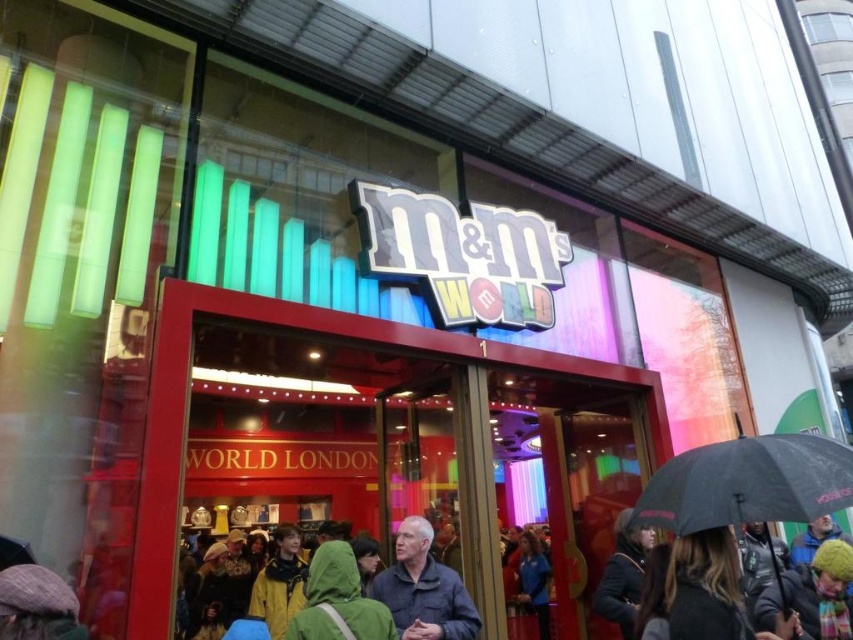
Question: Among these objects, which one is farthest from the camera?

Choices:
 (A) black matte umbrella at lower right
 (B) green hooded jacket at center
 (C) green matte jacket at center
 (D) dark blue jacket at center

Answer: (B)

Question: Is green hooded jacket at center above dark blue jacket at center?

Choices:
 (A) yes
 (B) no

Answer: (A)

Question: Among these points, which one is nearest to the camera?

Choices:
 (A) (766, 444)
 (B) (213, 301)
 (C) (636, 541)
 (D) (305, 621)

Answer: (D)

Question: Where is black matte umbrella at lower right located in relation to green matte jacket at center in the image?

Choices:
 (A) left
 (B) right

Answer: (B)

Question: Based on their relative distances, which object is farther from the black fuzzy hat at lower right?

Choices:
 (A) green hooded jacket at center
 (B) black matte umbrella at lower right
 (C) green matte jacket at center
 (D) red plastic sign at center

Answer: (C)

Question: Can you confirm if green hooded jacket at center is thinner than black fuzzy hat at lower right?

Choices:
 (A) yes
 (B) no

Answer: (A)